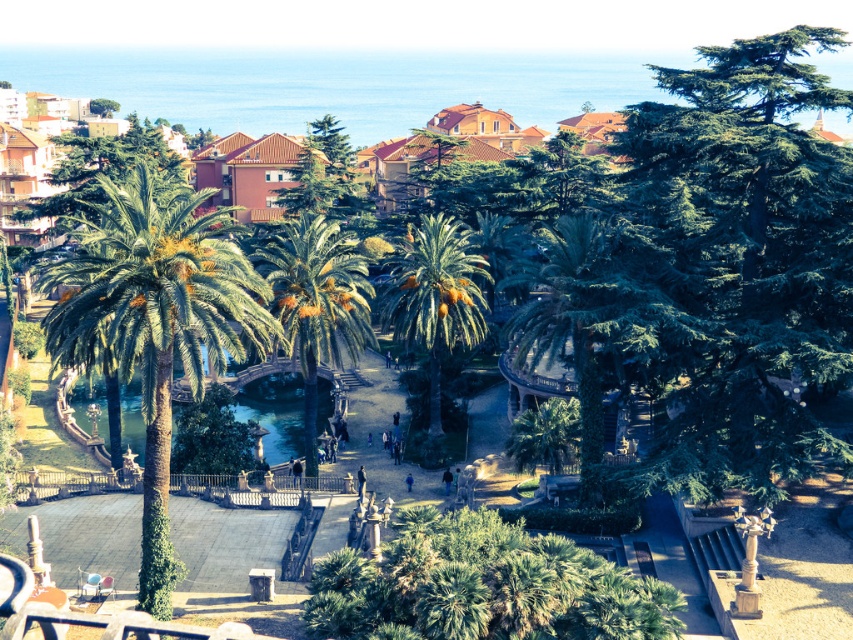
Is green leafy palm tree at left in front of green glossy water at center?

That is True.

Is green leafy palm tree at left positioned behind green glossy water at center?

No, green leafy palm tree at left is in front of green glossy water at center.

In order to click on green leafy palm tree at left in this screenshot , I will do `click(155, 324)`.

What do you see at coordinates (316, 304) in the screenshot? I see `green leafy palm tree at center` at bounding box center [316, 304].

Does point (321, 294) lie in front of point (419, 289)?

Yes, it is in front of point (419, 289).

Identify the location of green leafy palm tree at center. (316, 304).

Is green leafy palm at center thinner than green glossy water at center?

Yes.

Which is behind, point (437, 403) or point (76, 416)?

The point (76, 416) is behind.

Is point (395, 328) positioned behind point (236, 401)?

That is False.

Locate an element on the screen. This screenshot has width=853, height=640. green leafy palm at center is located at coordinates (434, 296).